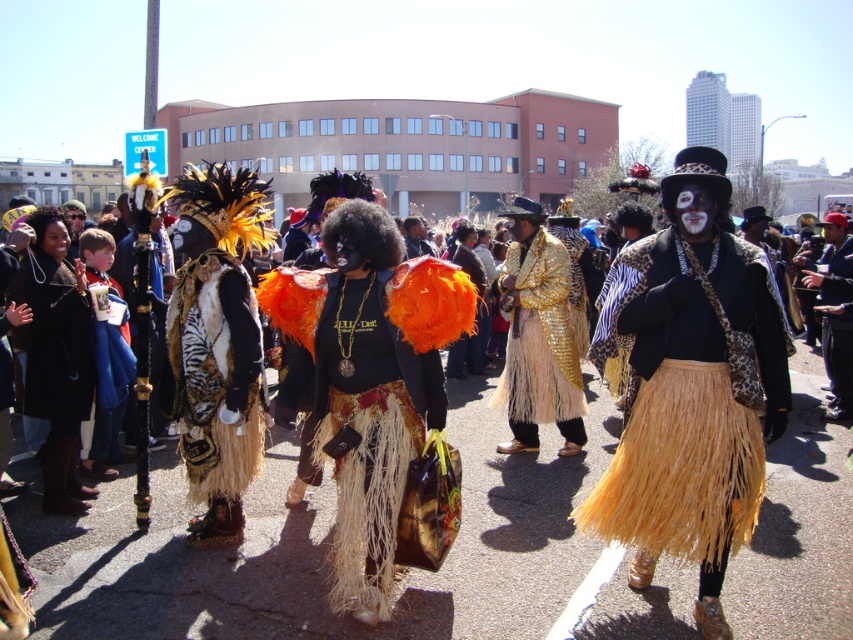
Looking at this image, you are a photographer at the parade and want to capture both the gold sequined jacket at center and the leopard print jacket at center in a single frame. Which jacket should you focus on first to ensure both are visible in the photo?

The gold sequined jacket at center is located below the leopard print jacket at center. To capture both in a single frame, focus on the leopard print jacket at center first since it is higher up, ensuring the lower gold sequened jacket at center remains in the shot.

You are a photographer positioned at the center of the scene. You want to capture a photo of the orange feathered skirt at center. According to the coordinates provided, in which direction should you move your camera to focus on the skirt?

The orange feathered skirt at center is located at coordinates point (367, 396). Since the photographer is at the center of the scene, they should move the camera slightly to the right and down to align with the skirt.

You are a photographer trying to capture the leopard print cape at center and the gold sequined jacket at center in a single shot. Which of the two items is positioned closer to you?

The leopard print cape at center is closer to the viewer than the gold sequined jacket at center, so the leopard print cape at center is positioned closer to you.